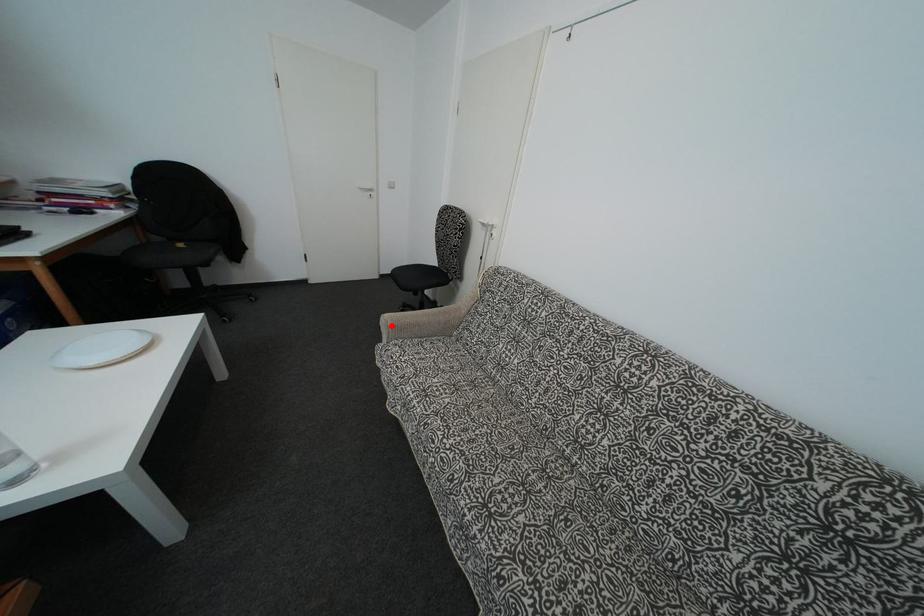
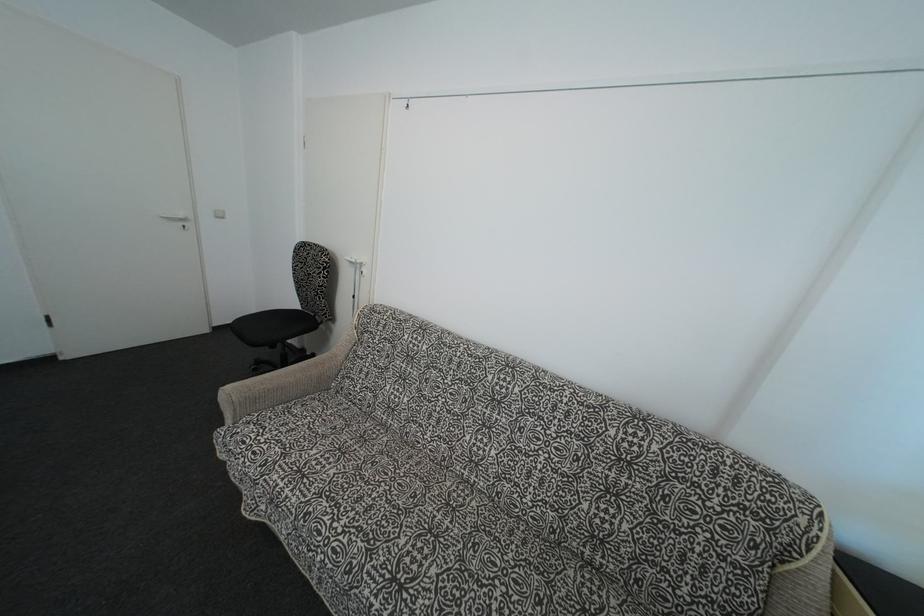
The point at the highlighted location is marked in the first image. Where is the corresponding point in the second image?

(235, 399)